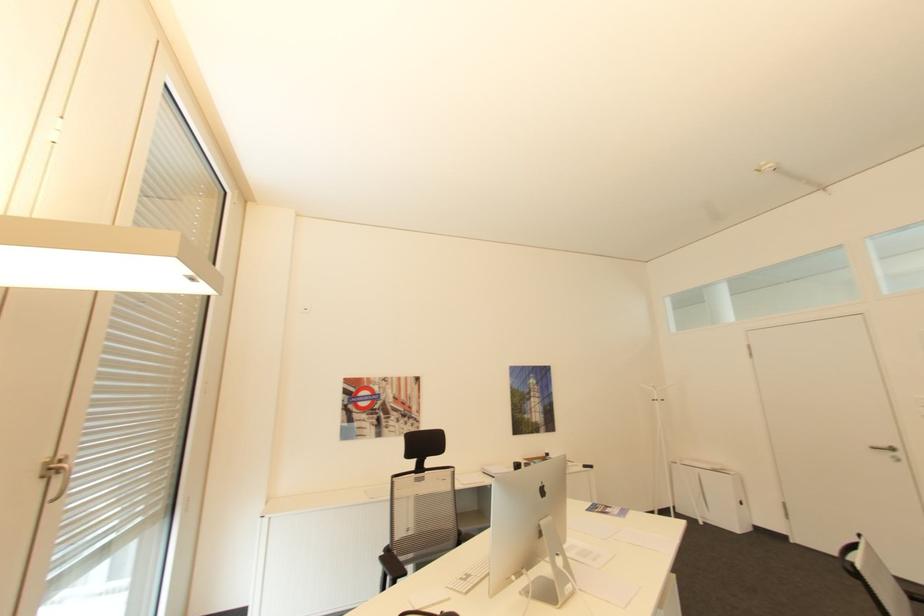
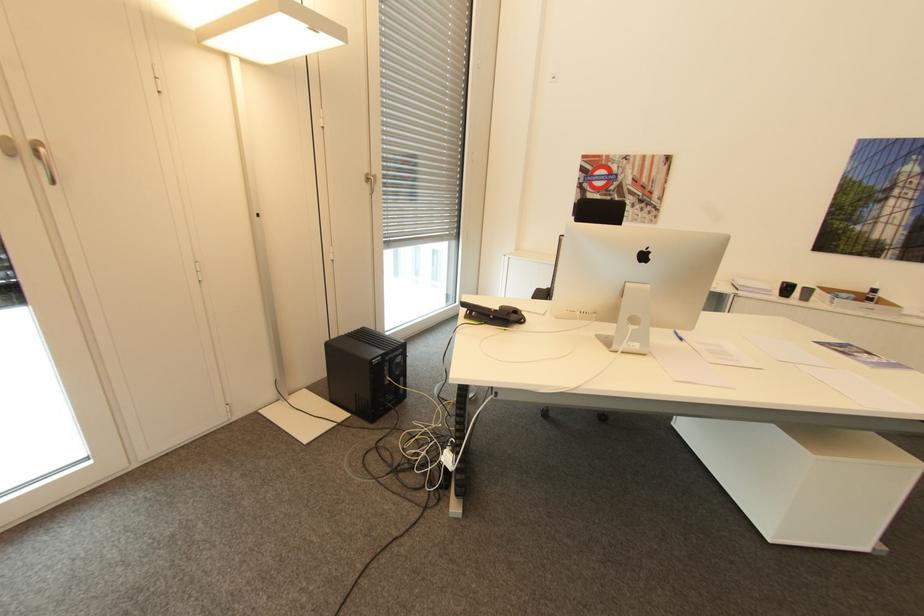
The point at [519,463] is marked in the first image. Where is the corresponding point in the second image?

(788, 283)